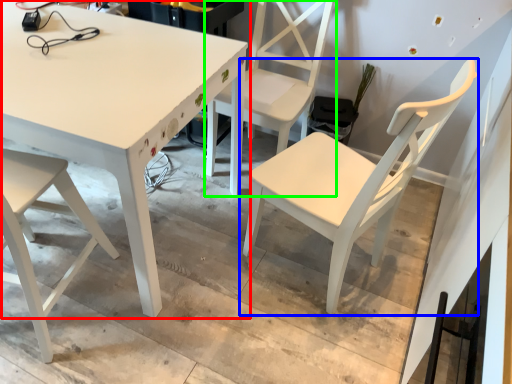
Question: Considering the real-world distances, which object is farthest from table (highlighted by a red box)? chair (highlighted by a blue box) or chair (highlighted by a green box)?

Choices:
 (A) chair
 (B) chair

Answer: (A)